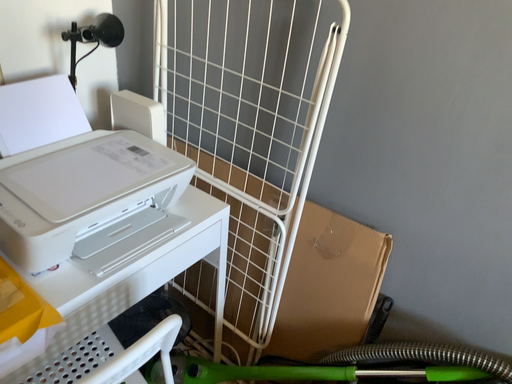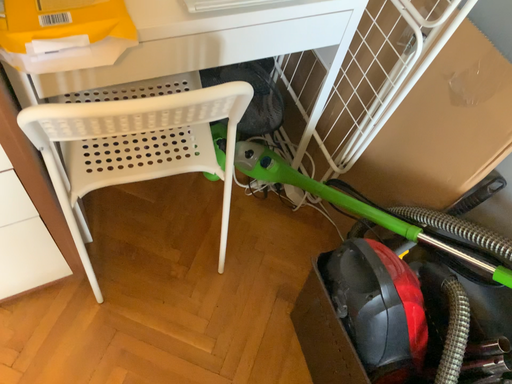
Question: Which way did the camera rotate in the video?

Choices:
 (A) rotated right
 (B) rotated left

Answer: (B)